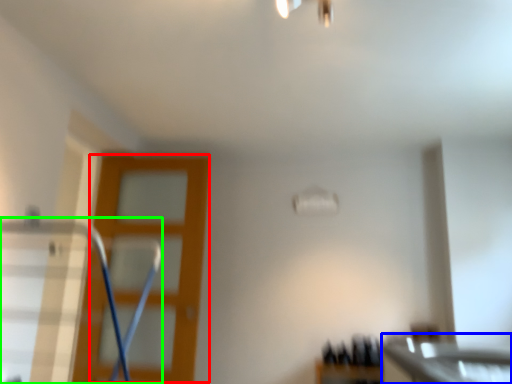
Question: Which is farther away from screen door (highlighted by a red box)? counter top (highlighted by a blue box) or swivel chair (highlighted by a green box)?

Choices:
 (A) counter top
 (B) swivel chair

Answer: (A)